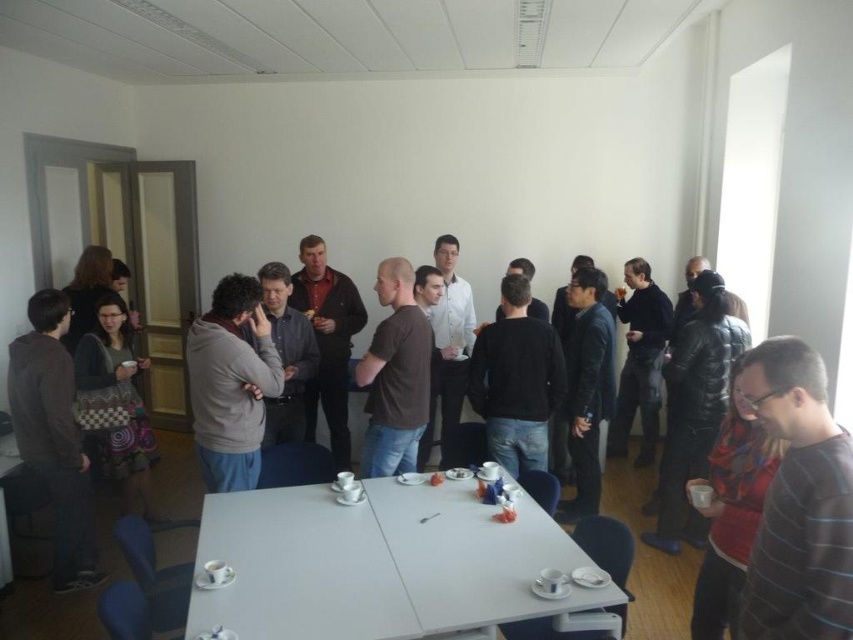
Question: Which object is positioned farthest from the brown matte shirt at center?

Choices:
 (A) dark gray sweater at center
 (B) black matte shirt at center
 (C) matte gray hoodie at left

Answer: (C)

Question: Which of the following is the farthest from the observer?

Choices:
 (A) knitted sweater at center
 (B) striped cotton shirt at lower right
 (C) matte gray hoodie at left
 (D) black matte shirt at center

Answer: (A)

Question: Which object is positioned closest to the striped cotton shirt at lower right?

Choices:
 (A) black matte shirt at center
 (B) matte gray hoodie at left

Answer: (A)

Question: Is the position of striped cotton shirt at lower right more distant than that of black matte shirt at center?

Choices:
 (A) yes
 (B) no

Answer: (B)

Question: Can you confirm if striped cotton shirt at lower right is bigger than black matte shirt at center?

Choices:
 (A) no
 (B) yes

Answer: (A)

Question: Is white glossy table at center thinner than brown matte shirt at center?

Choices:
 (A) yes
 (B) no

Answer: (B)